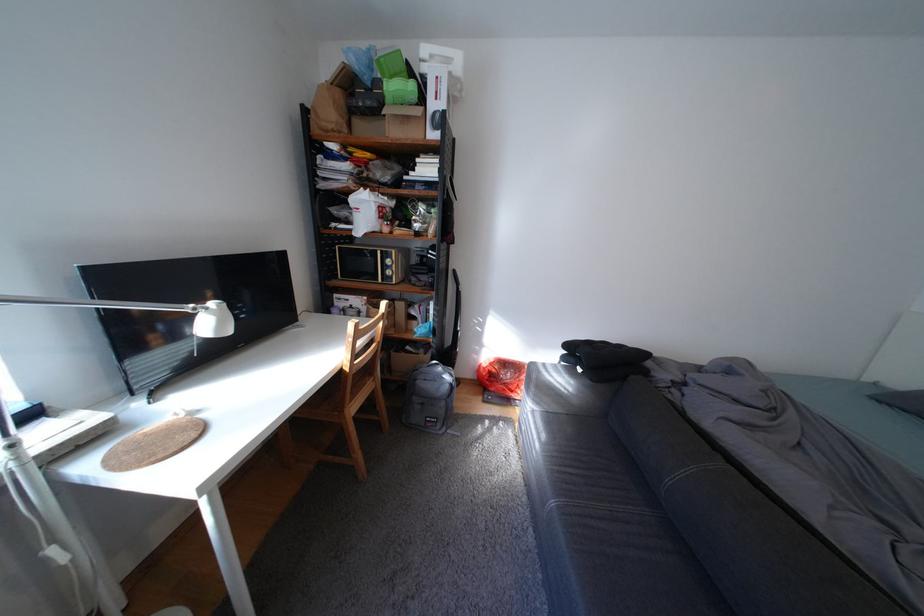
Where is `microwave dial`? microwave dial is located at coordinates (388, 265).